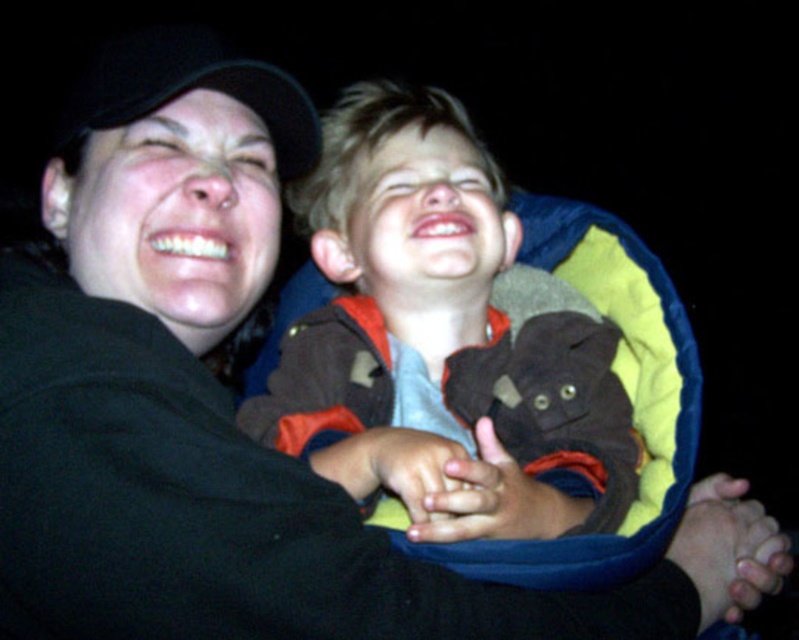
Is brown fuzzy stuffed animal at center wider than black fabric baseball cap at upper left?

Correct, the width of brown fuzzy stuffed animal at center exceeds that of black fabric baseball cap at upper left.

Does point (591, 529) come behind point (90, 129)?

No, (591, 529) is in front of (90, 129).

Identify the location of brown fuzzy stuffed animal at center. Image resolution: width=799 pixels, height=640 pixels. (440, 308).